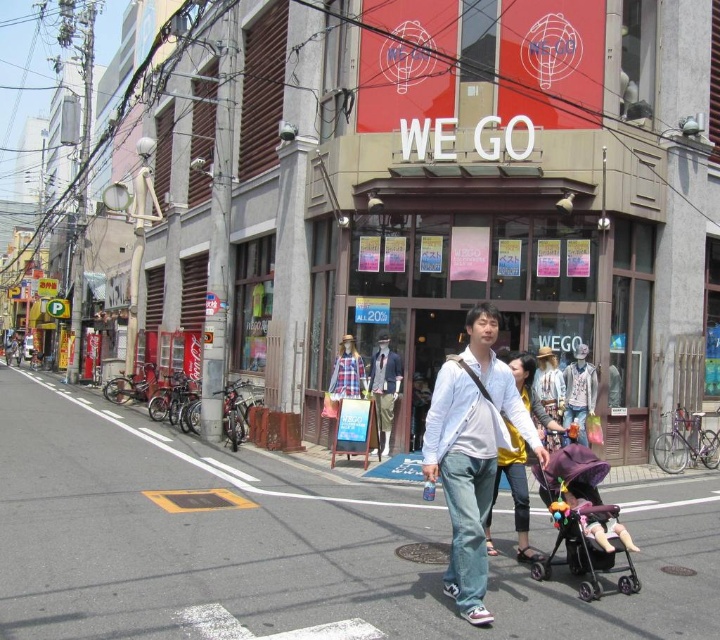
Question: Does matte blue shirt at center have a greater width compared to light purple fabric stroller at lower center?

Choices:
 (A) yes
 (B) no

Answer: (B)

Question: Which point is closer to the camera taking this photo?

Choices:
 (A) (490, 550)
 (B) (580, 369)
 (C) (446, 499)

Answer: (C)

Question: Is light blue denim jeans at center smaller than light yellow fabric dress at center?

Choices:
 (A) no
 (B) yes

Answer: (B)

Question: Considering the real-world distances, which object is closest to the black plastic baby carriage at lower right?

Choices:
 (A) light blue denim jeans at center
 (B) matte purple dress at center

Answer: (A)

Question: Which of the following is the closest to the observer?

Choices:
 (A) (390, 380)
 (B) (518, 548)

Answer: (B)

Question: Can you confirm if light blue denim jeans at center is positioned above denim jacket at center?

Choices:
 (A) yes
 (B) no

Answer: (A)